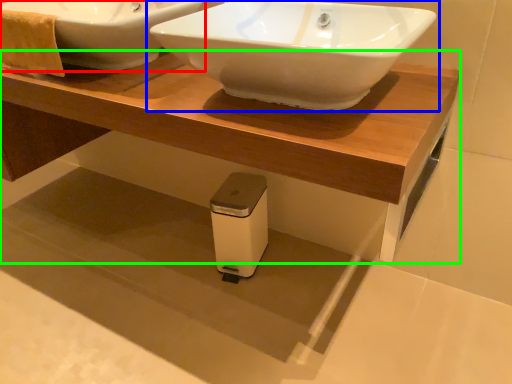
Question: Which is farther away from sink (highlighted by a red box)? sink (highlighted by a blue box) or table (highlighted by a green box)?

Choices:
 (A) sink
 (B) table

Answer: (A)